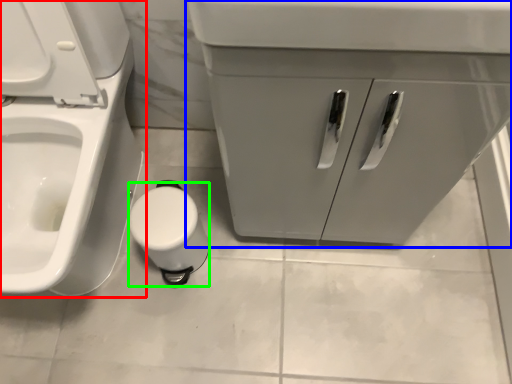
Question: Which object is the closest to the toilet (highlighted by a red box)? Choose among these: bathroom cabinet (highlighted by a blue box) or toilet paper (highlighted by a green box).

Choices:
 (A) bathroom cabinet
 (B) toilet paper

Answer: (B)